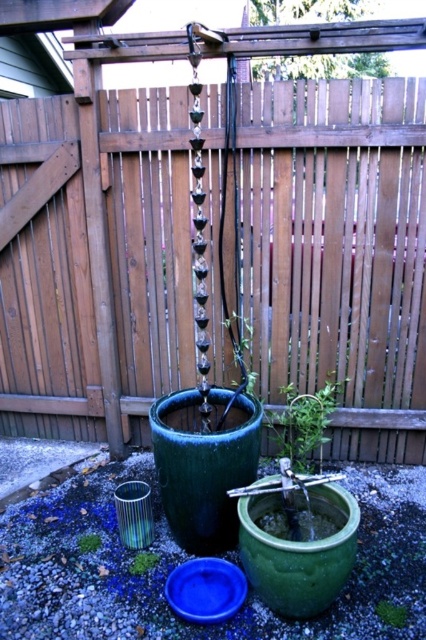
Who is positioned more to the left, green leafy plant at lower center or green glossy plant at lower center?

From the viewer's perspective, green glossy plant at lower center appears more on the left side.

Is the position of green leafy plant at lower center less distant than that of green glossy plant at lower center?

That is True.

Image resolution: width=426 pixels, height=640 pixels. Describe the element at coordinates (391, 612) in the screenshot. I see `green leafy plant at lower center` at that location.

Identify the location of green leafy plant at lower center. (391, 612).

This screenshot has height=640, width=426. Describe the element at coordinates (143, 563) in the screenshot. I see `green glossy plant at lower center` at that location.

Which is more to the right, green glossy plant at lower center or green matte plant at lower center?

green glossy plant at lower center

Is point (144, 572) closer to camera compared to point (86, 544)?

Yes, point (144, 572) is closer to viewer.

The height and width of the screenshot is (640, 426). Find the location of `green glossy plant at lower center`. green glossy plant at lower center is located at coordinates (143, 563).

Can you confirm if wooden fence at center is taller than green matte plant at center?

Yes.

Is wooden fence at center to the left of green matte plant at center from the viewer's perspective?

Indeed, wooden fence at center is positioned on the left side of green matte plant at center.

Where is `wooden fence at center`? Image resolution: width=426 pixels, height=640 pixels. wooden fence at center is located at coordinates click(337, 252).